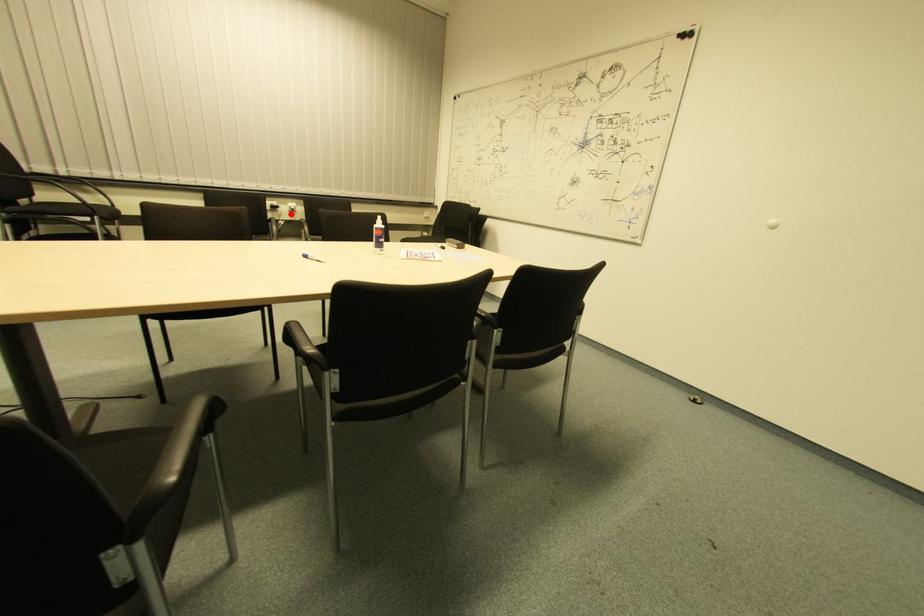
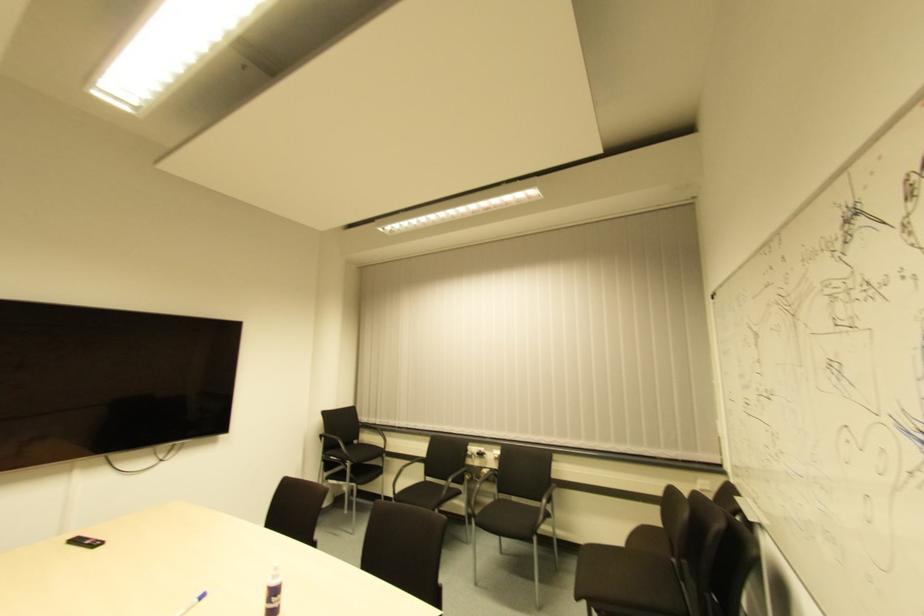
Question: I am providing you with two images of the same scene from different viewpoints. In image1, a red point is highlighted. Considering the same 3D point in image2, which of the following is correct?

Choices:
 (A) It is closer
 (B) It is farther

Answer: (B)